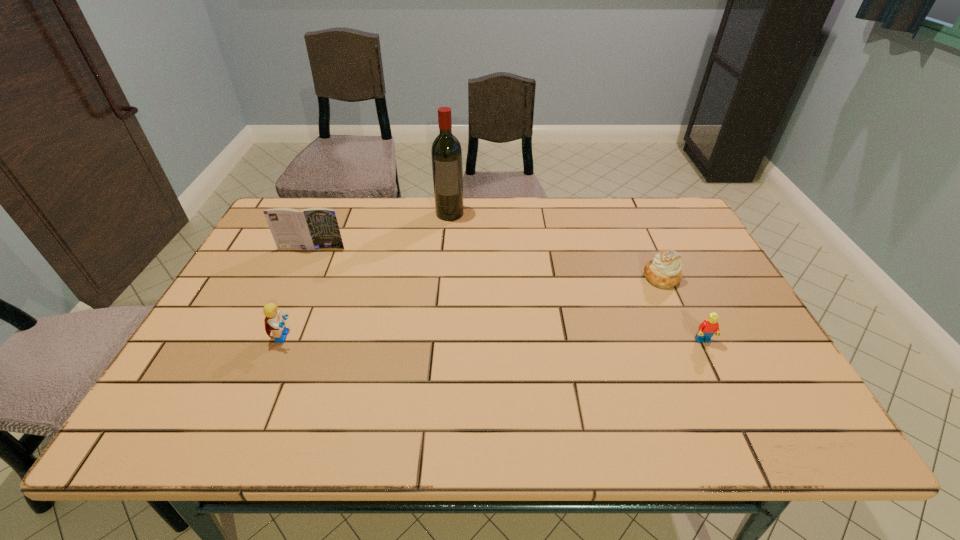
This screenshot has width=960, height=540. Identify the location of unoccupied position between the second tallest object and the shorter Lego. (507, 294).

Locate an element on the screen. The image size is (960, 540). vacant space that is in between the third nearest object and the shorter Lego is located at coordinates (683, 309).

This screenshot has height=540, width=960. Identify the location of object that is the second closest to the third object from left to right. (274, 322).

You are a GUI agent. You are given a task and a screenshot of the screen. Output one action in this format:
    pyautogui.click(x=<x>, y=<y>)
    Task: Click on the object that is the fourth closest one to the book
    Image resolution: width=960 pixels, height=540 pixels.
    Given the screenshot: What is the action you would take?
    (709, 327)

Where is `vacant space that satisfies the following two spatial constraints: 1. on the front cover of the book; 2. on the right side of the pastry`? vacant space that satisfies the following two spatial constraints: 1. on the front cover of the book; 2. on the right side of the pastry is located at coordinates (299, 277).

Find the location of `vacant point that satisfies the following two spatial constraints: 1. on the label of the tallest object; 2. on the left side of the pastry`. vacant point that satisfies the following two spatial constraints: 1. on the label of the tallest object; 2. on the left side of the pastry is located at coordinates (444, 277).